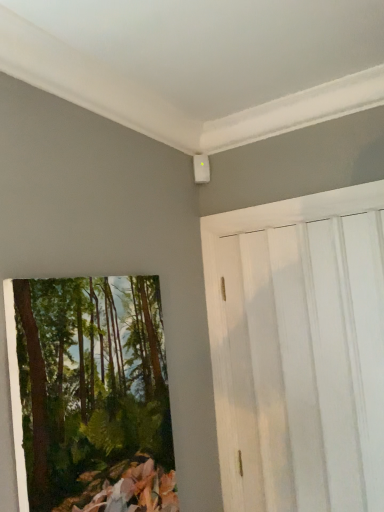
Image resolution: width=384 pixels, height=512 pixels. Describe the element at coordinates (92, 386) in the screenshot. I see `green textured painting at left` at that location.

The image size is (384, 512). Find the location of `green textured painting at left`. green textured painting at left is located at coordinates (92, 386).

From the picture: What is the approximate height of green textured painting at left?

83.51 centimeters.

Image resolution: width=384 pixels, height=512 pixels. I want to click on white wood barn door at upper right, so click(x=299, y=350).

This screenshot has width=384, height=512. Describe the element at coordinates (299, 350) in the screenshot. I see `white wood barn door at upper right` at that location.

Find the location of a particular element. The height and width of the screenshot is (512, 384). green textured painting at left is located at coordinates (92, 386).

Visually, is white wood barn door at upper right positioned to the left or to the right of green textured painting at left?

white wood barn door at upper right is positioned on green textured painting at left's right side.

Is white wood barn door at upper right positioned before green textured painting at left?

No, white wood barn door at upper right is further to the viewer.

Which point is more distant from viewer, (322,238) or (102,463)?

Point (322,238)

From the image's perspective, which is above, white wood barn door at upper right or green textured painting at left?

white wood barn door at upper right.

From a real-world perspective, which is physically below, white wood barn door at upper right or green textured painting at left?

green textured painting at left, from a real-world perspective.

Can you confirm if white wood barn door at upper right is thinner than green textured painting at left?

Yes, white wood barn door at upper right is thinner than green textured painting at left.

From the picture: Is white wood barn door at upper right shorter than green textured painting at left?

Incorrect, the height of white wood barn door at upper right does not fall short of that of green textured painting at left.

From the picture: Can you confirm if white wood barn door at upper right is bigger than green textured painting at left?

Yes, white wood barn door at upper right is bigger than green textured painting at left.

Does white wood barn door at upper right contain green textured painting at left?

No.

Are white wood barn door at upper right and green textured painting at left located far from each other?

No, white wood barn door at upper right is not far from green textured painting at left.

Is white wood barn door at upper right oriented towards green textured painting at left?

Yes, white wood barn door at upper right is facing green textured painting at left.

Identify the location of tree beneath the white wood barn door at upper right (from a real-world perspective). The width and height of the screenshot is (384, 512). (92, 386).

Which object is positioned more to the right, green textured painting at left or white wood barn door at upper right?

white wood barn door at upper right is more to the right.

From the picture: Which object is closer to the camera, green textured painting at left or white wood barn door at upper right?

green textured painting at left is more forward.

Is point (53, 294) behind point (240, 304)?

No, (53, 294) is closer to viewer.

Based on the photo, from the image's perspective, which one is positioned higher, green textured painting at left or white wood barn door at upper right?

white wood barn door at upper right appears higher in the image.

From a real-world perspective, is green textured painting at left located beneath white wood barn door at upper right?

Yes, from a real-world perspective, green textured painting at left is below white wood barn door at upper right.

Considering the relative sizes of green textured painting at left and white wood barn door at upper right in the image provided, is green textured painting at left thinner than white wood barn door at upper right?

Incorrect, the width of green textured painting at left is not less than that of white wood barn door at upper right.

Is green textured painting at left shorter than white wood barn door at upper right?

Yes.

Considering the sizes of green textured painting at left and white wood barn door at upper right in the image, is green textured painting at left bigger or smaller than white wood barn door at upper right?

green textured painting at left is smaller than white wood barn door at upper right.

Would you say white wood barn door at upper right is part of green textured painting at left's contents?

That's incorrect, white wood barn door at upper right is not inside green textured painting at left.

Would you consider green textured painting at left to be distant from white wood barn door at upper right?

No, green textured painting at left is not far from white wood barn door at upper right.

Is green textured painting at left oriented towards white wood barn door at upper right?

No, green textured painting at left does not turn towards white wood barn door at upper right.

How different are the orientations of green textured painting at left and white wood barn door at upper right in degrees?

90 degrees.

How much distance is there between green textured painting at left and white wood barn door at upper right?

green textured painting at left is 24.89 inches away from white wood barn door at upper right.

Image resolution: width=384 pixels, height=512 pixels. I want to click on tree lying below the white wood barn door at upper right (from the image's perspective), so (x=92, y=386).

Where is `barn door lying behind the green textured painting at left`? This screenshot has height=512, width=384. barn door lying behind the green textured painting at left is located at coordinates (299, 350).

The width and height of the screenshot is (384, 512). In order to click on tree located in front of the white wood barn door at upper right in this screenshot , I will do `click(92, 386)`.